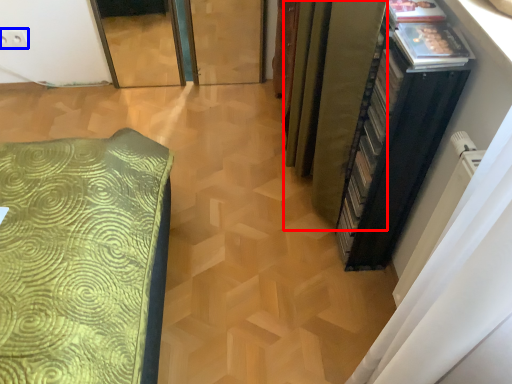
Question: Among these objects, which one is nearest to the camera, curtain (highlighted by a red box) or electric outlet (highlighted by a blue box)?

Choices:
 (A) curtain
 (B) electric outlet

Answer: (A)